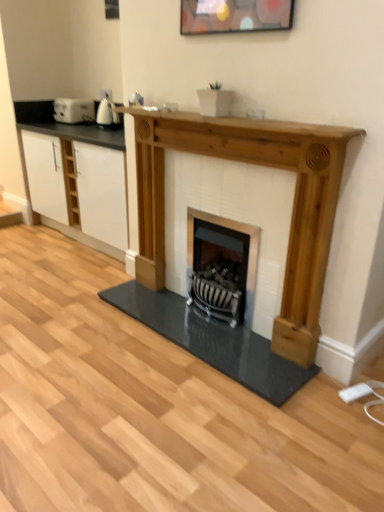
Question: Considering the positions of white glossy kettle at upper left, positioned as the 2th appliance in left-to-right order, and natural wood fireplace at center in the image, is white glossy kettle at upper left, positioned as the 2th appliance in left-to-right order, taller or shorter than natural wood fireplace at center?

Choices:
 (A) tall
 (B) short

Answer: (B)

Question: From a real-world perspective, is white glossy kettle at upper left, arranged as the first appliance when viewed from the right, positioned above or below natural wood fireplace at center?

Choices:
 (A) below
 (B) above

Answer: (B)

Question: Which object is positioned farthest from the black metal wood burning stove at center?

Choices:
 (A) white glossy kettle at upper left, positioned as the 2th appliance in left-to-right order
 (B) white matte cabinet at center
 (C) wooden shelf at center
 (D) white plastic toaster at left, which is the 1th appliance from left to right
 (E) natural wood fireplace at center

Answer: (D)

Question: Estimate the real-world distances between objects in this image. Which object is farther from the white matte cabinet at center?

Choices:
 (A) wooden shelf at center
 (B) black metal wood burning stove at center
 (C) white plastic toaster at left, which ranks as the second appliance in right-to-left order
 (D) natural wood fireplace at center
 (E) white glossy kettle at upper left, the 1th appliance positioned from the front

Answer: (B)